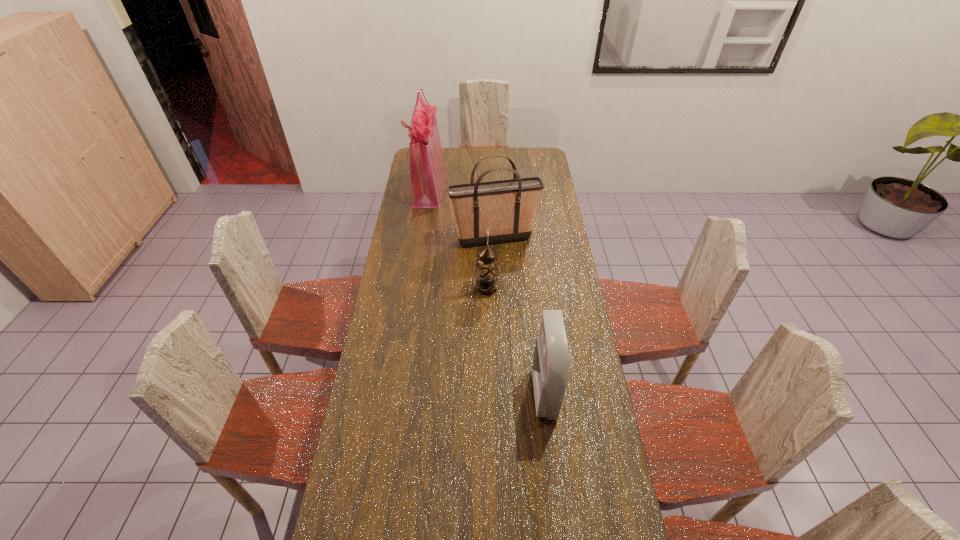
Find the location of a particular element. This screenshot has width=960, height=540. the taller shopping bag is located at coordinates (427, 168).

Identify the location of the farther shopping bag. (427, 168).

Identify the location of the second farthest object. (507, 207).

In order to click on the shorter shopping bag in this screenshot , I will do `click(507, 207)`.

Where is `the first-aid kit`? the first-aid kit is located at coordinates (551, 365).

Where is `the third farthest object`? the third farthest object is located at coordinates (487, 271).

Locate an element on the screen. This screenshot has width=960, height=540. free spot located on the back of the taller shopping bag is located at coordinates (433, 160).

Where is `vacant region located 0.280m on the back of the second tallest object`? vacant region located 0.280m on the back of the second tallest object is located at coordinates click(x=492, y=196).

Locate an element on the screen. The height and width of the screenshot is (540, 960). free space located on the front-facing side of the nearest object is located at coordinates (429, 394).

Locate an element on the screen. blank space located on the front-facing side of the nearest object is located at coordinates (519, 394).